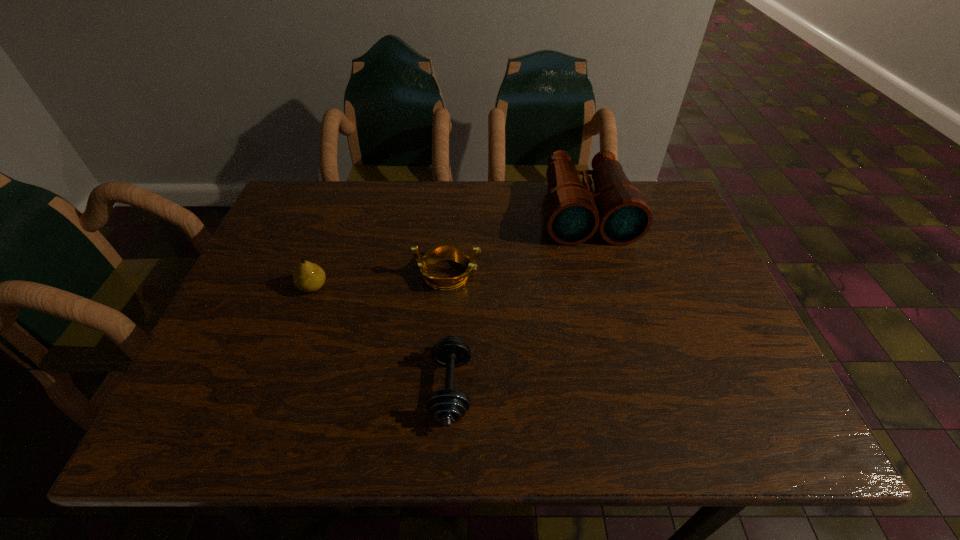
Locate an element on the screen. object that stands as the second closest to the tiara is located at coordinates (573, 213).

Locate an element on the screen. The width and height of the screenshot is (960, 540). vacant space that satisfies the following two spatial constraints: 1. at the front emblem of the tiara; 2. on the left side of the dumbbell is located at coordinates (440, 388).

Where is `blank area in the image that satisfies the following two spatial constraints: 1. at the front emblem of the tiara; 2. on the right side of the shortest object`? blank area in the image that satisfies the following two spatial constraints: 1. at the front emblem of the tiara; 2. on the right side of the shortest object is located at coordinates (440, 388).

At what (x,y) coordinates should I click in order to perform the action: click on vacant space that satisfies the following two spatial constraints: 1. at the front emblem of the tiara; 2. on the front side of the leftmost object. Please return your answer as a coordinate pair (x, y). This screenshot has height=540, width=960. Looking at the image, I should click on (447, 287).

Locate an element on the screen. This screenshot has width=960, height=540. vacant space that satisfies the following two spatial constraints: 1. at the front emblem of the tiara; 2. on the back side of the nearest object is located at coordinates (440, 388).